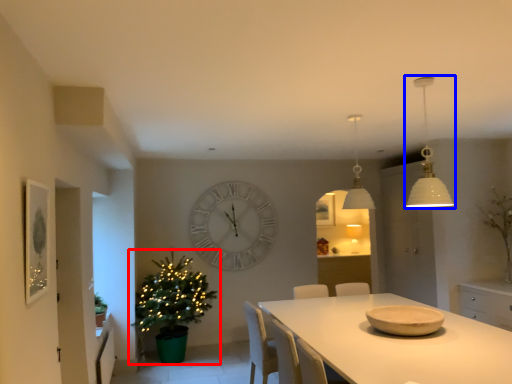
Question: Which object is closer to the camera taking this photo, christmas tree (highlighted by a red box) or lamp (highlighted by a blue box)?

Choices:
 (A) christmas tree
 (B) lamp

Answer: (B)